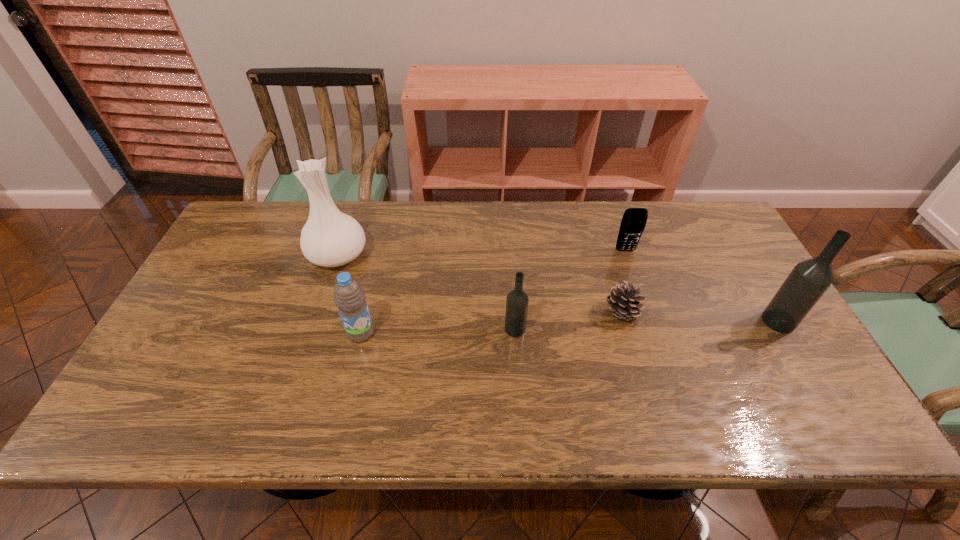
Locate an element on the screen. the fourth object from right to left is located at coordinates (517, 300).

The height and width of the screenshot is (540, 960). What are the coordinates of `the shorter vodka` in the screenshot? It's located at (517, 300).

Find the location of `the rightmost object`. the rightmost object is located at coordinates (808, 281).

Locate an element on the screen. The image size is (960, 540). the taller vodka is located at coordinates (808, 281).

The height and width of the screenshot is (540, 960). Find the location of `water bottle`. water bottle is located at coordinates (349, 297).

At what (x,y) coordinates should I click in order to perform the action: click on the shortest object. Please return your answer as a coordinate pair (x, y). Looking at the image, I should click on (623, 301).

Where is `the fifth tallest object`? the fifth tallest object is located at coordinates (633, 222).

At what (x,y) coordinates should I click in order to perform the action: click on vase. Please return your answer as a coordinate pair (x, y). This screenshot has width=960, height=540. Looking at the image, I should click on (330, 238).

At what (x,y) coordinates should I click in order to perform the action: click on vacant region located 0.210m on the left of the left vodka. Please return your answer as a coordinate pair (x, y). This screenshot has width=960, height=540. Looking at the image, I should click on (423, 329).

Locate an element on the screen. This screenshot has height=540, width=960. vacant space located on the left of the rightmost object is located at coordinates (721, 321).